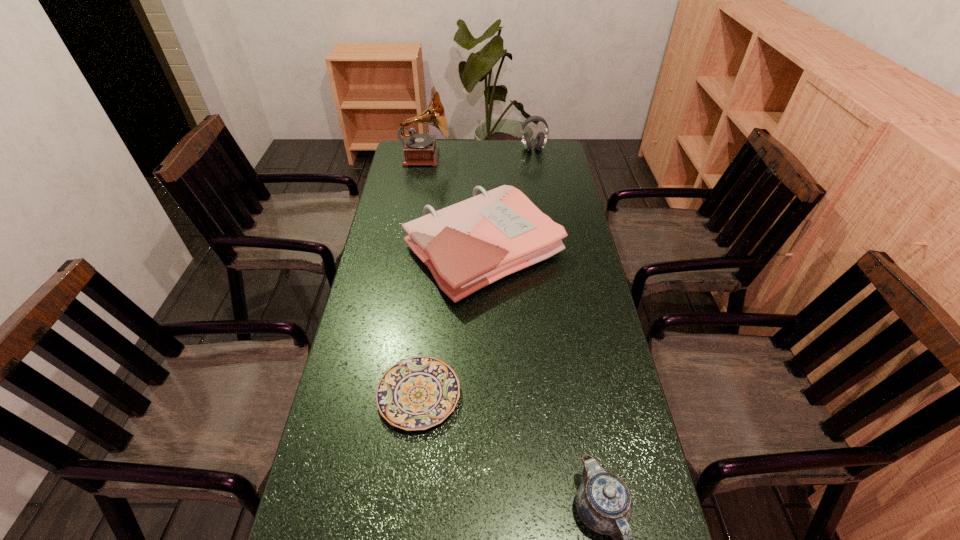
Identify the location of the tallest object. The height and width of the screenshot is (540, 960). (419, 149).

Where is `the fourth shortest object`? Image resolution: width=960 pixels, height=540 pixels. the fourth shortest object is located at coordinates (541, 138).

What are the coordinates of `phonebook` in the screenshot? It's located at (466, 246).

This screenshot has width=960, height=540. What are the coordinates of `plate` in the screenshot? It's located at (417, 393).

Where is `the fourth farthest object`? The height and width of the screenshot is (540, 960). the fourth farthest object is located at coordinates (417, 393).

Identify the location of vacant space situated 0.310m on the horn of the phonograph_record. pos(520,158).

Locate an element on the screen. vacant region located on the ear cups of the second tallest object is located at coordinates (539, 184).

The image size is (960, 540). In order to click on vacant area located 0.230m on the front of the third nearest object in this screenshot , I will do `click(485, 376)`.

The height and width of the screenshot is (540, 960). I want to click on blank space located 0.320m on the back of the plate, so click(x=432, y=276).

Find the location of `phonograph_record at the far edge`. phonograph_record at the far edge is located at coordinates (419, 149).